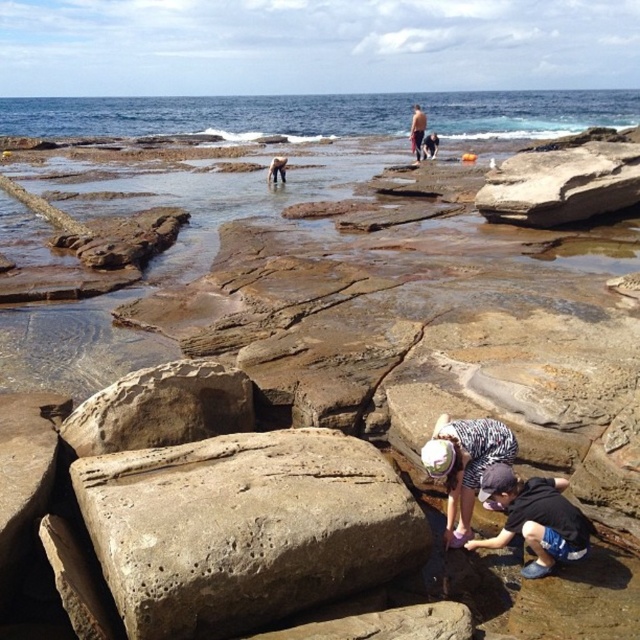
Question: Which object appears closest to the camera in this image?

Choices:
 (A) smooth sand at center
 (B) dark blue fabric squat at lower right

Answer: (B)

Question: Which point appears closest to the camera in this image?

Choices:
 (A) (508, 193)
 (B) (412, 131)
 (C) (532, 496)
 (D) (284, 163)

Answer: (C)

Question: Does brown rough rock at center appear on the left side of dark blue shorts at center?

Choices:
 (A) yes
 (B) no

Answer: (B)

Question: Does blue water at upper center have a lesser width compared to dark blue fabric squat at lower right?

Choices:
 (A) no
 (B) yes

Answer: (A)

Question: Which object is positioned closest to the gray rough stone at center?

Choices:
 (A) blue water at upper center
 (B) dark blue shorts at center
 (C) brown rough rock at center
 (D) dark blue fabric squat at lower right

Answer: (D)

Question: Is blue water at upper center below dark blue fabric squat at lower right?

Choices:
 (A) no
 (B) yes

Answer: (A)